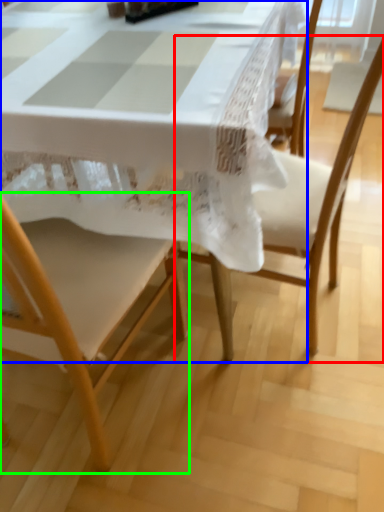
Question: Which object is positioned farthest from chair (highlighted by a red box)? Select from table (highlighted by a blue box) and chair (highlighted by a green box).

Choices:
 (A) table
 (B) chair

Answer: (A)